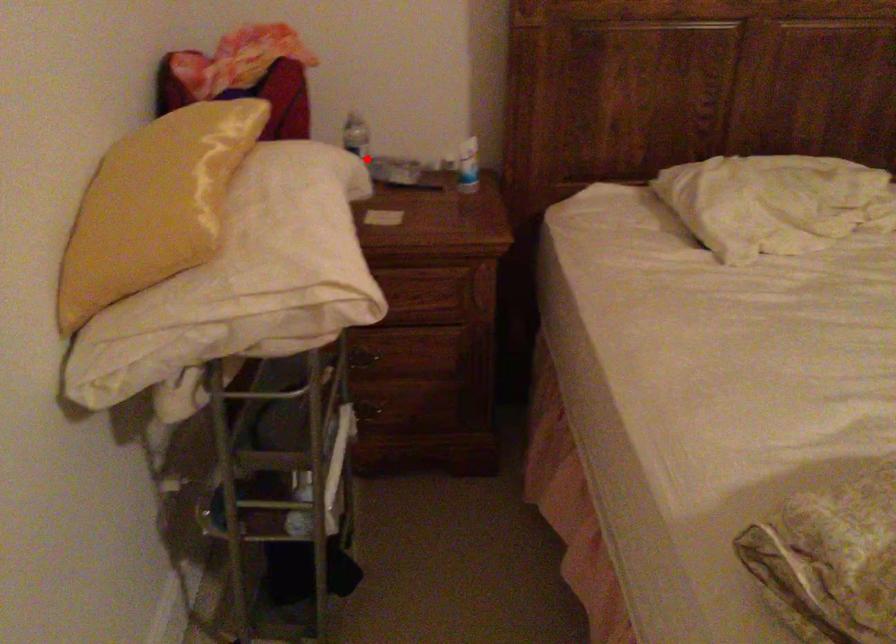
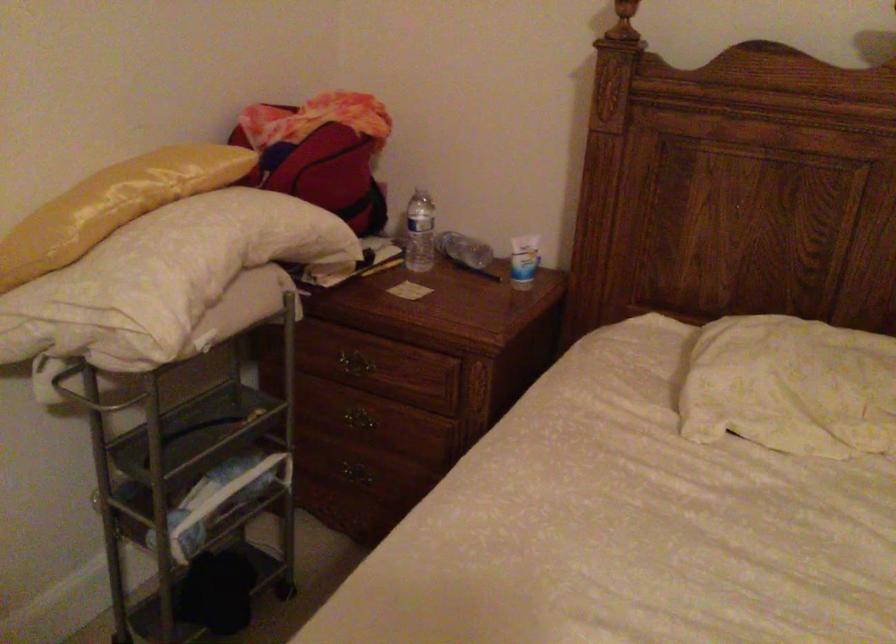
The point at the highlighted location is marked in the first image. Where is the corresponding point in the second image?

(419, 232)